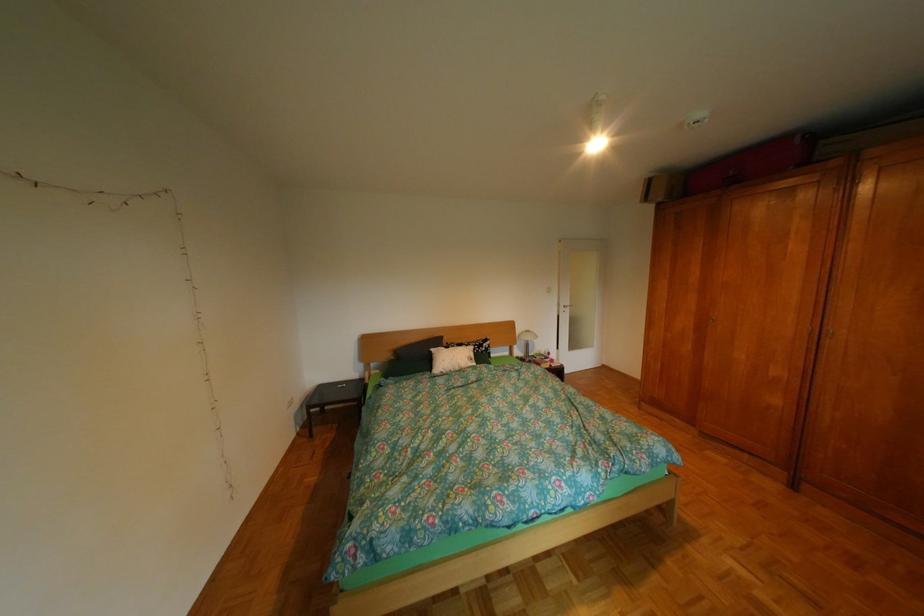
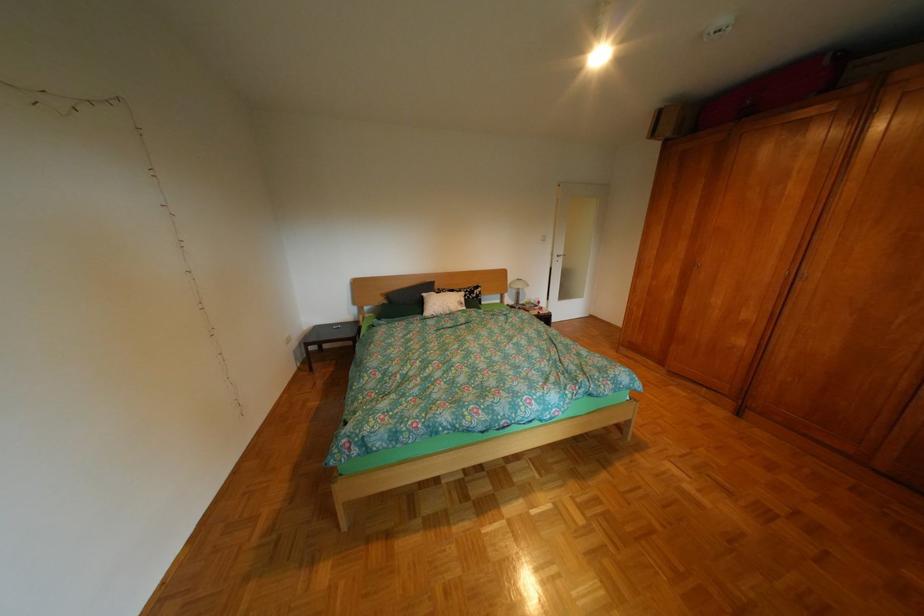
Where in the second image is the point corresponding to point 660,199 from the first image?

(667, 136)